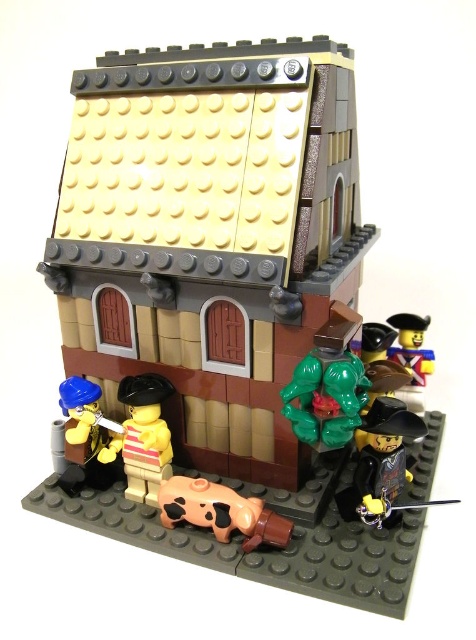
Between smooth yellow minifigure at lower left and yellow matte minifigure at upper right, which one is positioned higher?

yellow matte minifigure at upper right is higher up.

Describe the element at coordinates (83, 436) in the screenshot. I see `smooth yellow minifigure at lower left` at that location.

This screenshot has height=640, width=476. In order to click on smooth yellow minifigure at lower left in this screenshot , I will do `click(83, 436)`.

Based on the photo, does shiny black sword at lower right appear under smooth yellow minifigure at lower left?

Correct, shiny black sword at lower right is located below smooth yellow minifigure at lower left.

Who is shorter, shiny black sword at lower right or smooth yellow minifigure at lower left?

With less height is shiny black sword at lower right.

Is point (368, 500) positioned in front of point (96, 388)?

Yes, it is in front of point (96, 388).

You are a GUI agent. You are given a task and a screenshot of the screen. Output one action in this format:
    pyautogui.click(x=<x>, y=<y>)
    Task: Click on the shiny black sword at lower right
    
    Given the screenshot: What is the action you would take?
    pyautogui.click(x=379, y=460)

Based on the photo, between brown matte cow at lower center and smooth yellow minifigure at lower left, which one appears on the right side from the viewer's perspective?

brown matte cow at lower center

The image size is (476, 640). Identify the location of brown matte cow at lower center. (220, 512).